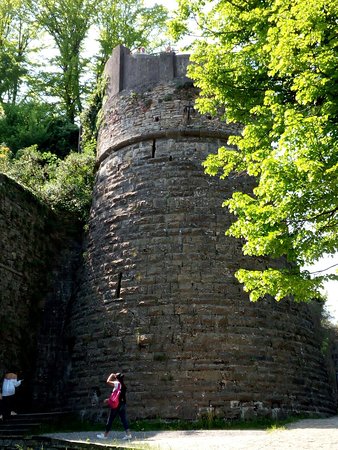
This screenshot has height=450, width=338. Identify the location of stairs. (24, 423).